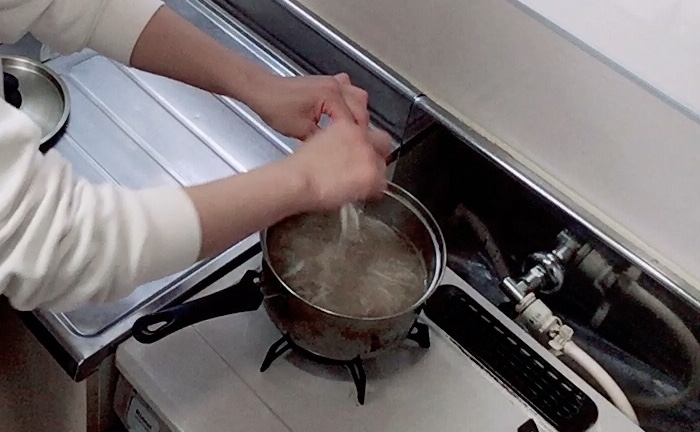
The width and height of the screenshot is (700, 432). I want to click on empty space behind stovetop, so click(558, 89), click(649, 39).